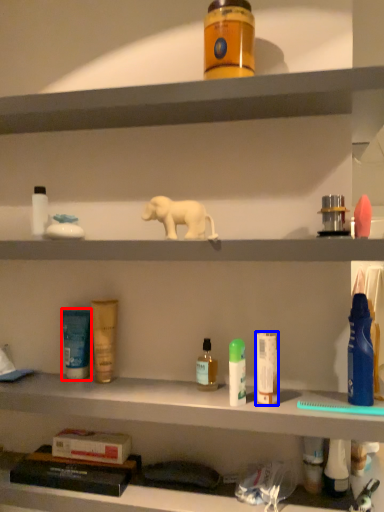
Question: Among these objects, which one is farthest to the camera, toiletry (highlighted by a red box) or toiletry (highlighted by a blue box)?

Choices:
 (A) toiletry
 (B) toiletry

Answer: (A)